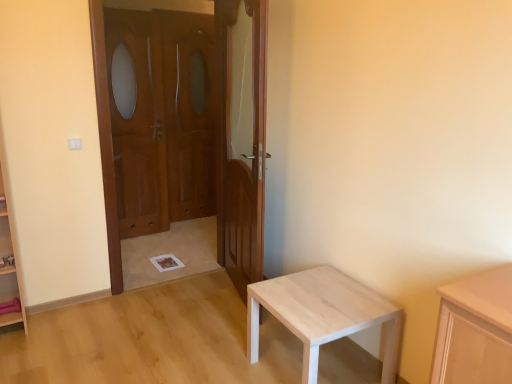
Where is `vacant area that lies in front of wooden at center, placed as the 2th door when sorted from left to right`? The image size is (512, 384). vacant area that lies in front of wooden at center, placed as the 2th door when sorted from left to right is located at coordinates (217, 333).